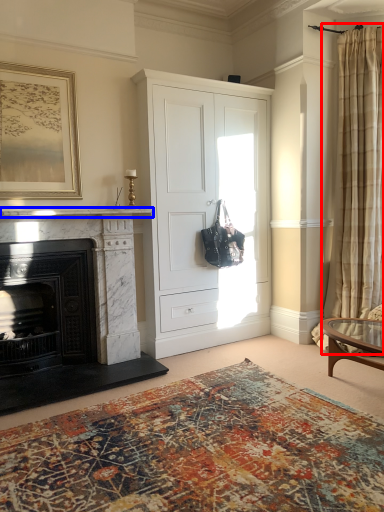
Question: Which of the following is the farthest to the observer, curtain (highlighted by a red box) or mantle (highlighted by a blue box)?

Choices:
 (A) curtain
 (B) mantle

Answer: (A)